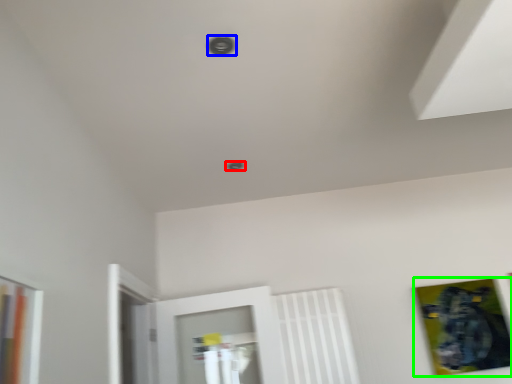
Question: Estimate the real-world distances between objects in this image. Which object is farther from hole (highlighted by a red box), hole (highlighted by a blue box) or picture frame (highlighted by a green box)?

Choices:
 (A) hole
 (B) picture frame

Answer: (B)